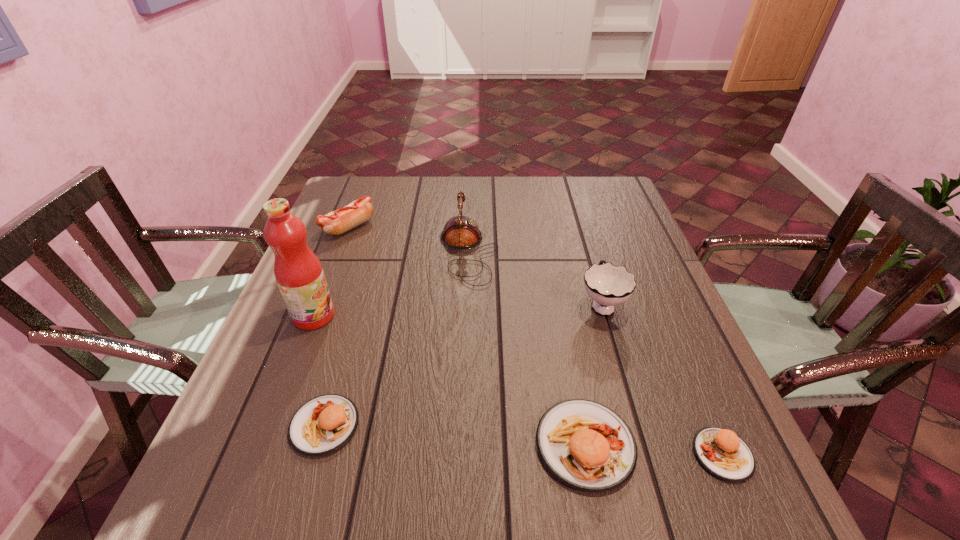
Where is `blank area at the left edge`? The image size is (960, 540). blank area at the left edge is located at coordinates (371, 228).

The width and height of the screenshot is (960, 540). I want to click on free space at the right edge of the desktop, so click(x=698, y=347).

This screenshot has height=540, width=960. Identify the location of free location at the far right corner. point(628,213).

You are a GUI agent. You are given a task and a screenshot of the screen. Output one action in this format:
    pyautogui.click(x=<x>, y=<y>)
    Task: Click on the free location at the near right corner
    This screenshot has height=540, width=960.
    Given the screenshot: What is the action you would take?
    pyautogui.click(x=673, y=427)

Find the location of a particular element. The width and height of the screenshot is (960, 540). empty space between the tallest object and the cup is located at coordinates (458, 309).

Find the location of `free space between the cup and the second patty from left to right`. free space between the cup and the second patty from left to right is located at coordinates (593, 374).

Identify the location of free space between the second patty from right to left and the cup. (x=593, y=374).

You are a GUI agent. You are given a task and a screenshot of the screen. Output one action in this format:
    pyautogui.click(x=<x>, y=<y>)
    Task: Click on the free space between the second patty from left to right and the tallest object
    Image resolution: width=960 pixels, height=540 pixels.
    Given the screenshot: What is the action you would take?
    pyautogui.click(x=449, y=380)

I want to click on vacant area between the rightmost patty and the leftmost patty, so click(x=523, y=440).

You are a GUI agent. You are given a task and a screenshot of the screen. Output one action in this format:
    pyautogui.click(x=<x>, y=<y>)
    Task: Click on the vacant area that lies between the fruit juice and the leftmost patty
    
    Given the screenshot: What is the action you would take?
    pyautogui.click(x=319, y=370)